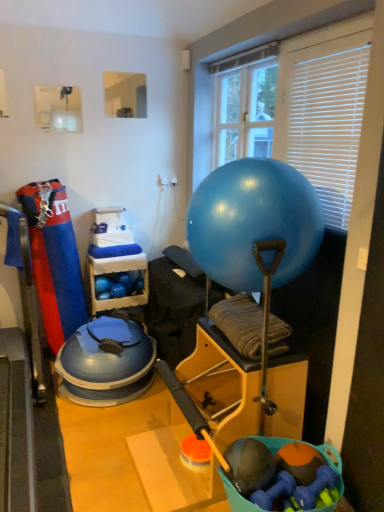
Locate an element on the screen. blue rubber ball at center is located at coordinates tap(254, 224).

This screenshot has height=512, width=384. Describe the element at coordinates (328, 127) in the screenshot. I see `white plastic blinds at upper right` at that location.

What are the coordinates of `blue rubber balls at center` in the screenshot? It's located at (116, 272).

This screenshot has width=384, height=512. In order to click on clear glass mirror at upper center, acting as the second window screen starting from the right in this screenshot , I will do `click(125, 95)`.

Is blue rubber balls at center not close to blue rubber ball at center?

blue rubber balls at center is far away from blue rubber ball at center.

Between blue rubber balls at center and blue rubber ball at center, which one appears on the right side from the viewer's perspective?

From the viewer's perspective, blue rubber ball at center appears more on the right side.

Based on the photo, how many degrees apart are the facing directions of blue rubber balls at center and blue rubber ball at center?

90.7 degrees separate the facing orientations of blue rubber balls at center and blue rubber ball at center.

From the image's perspective, is transparent plastic window screen at upper center, arranged as the second window screen when viewed from the left, under clear glass mirror at upper center, the first window screen in the left-to-right sequence?

Yes, from the image's perspective, transparent plastic window screen at upper center, arranged as the second window screen when viewed from the left, is beneath clear glass mirror at upper center, the first window screen in the left-to-right sequence.

Which is more to the right, transparent plastic window screen at upper center, acting as the first window screen starting from the right, or clear glass mirror at upper center, acting as the second window screen starting from the right?

transparent plastic window screen at upper center, acting as the first window screen starting from the right, is more to the right.

Considering the positions of points (230, 116) and (104, 80), is point (230, 116) farther from camera compared to point (104, 80)?

No.

In the scene shown: Considering the sizes of objects transparent plastic window screen at upper center, acting as the first window screen starting from the right, and clear glass mirror at upper center, the first window screen in the left-to-right sequence, in the image provided, who is wider, transparent plastic window screen at upper center, acting as the first window screen starting from the right, or clear glass mirror at upper center, the first window screen in the left-to-right sequence,?

transparent plastic window screen at upper center, acting as the first window screen starting from the right, is wider.

From the picture: From the image's perspective, does white plastic blinds at upper right appear higher than blue rubber ball at center?

Correct, white plastic blinds at upper right appears higher than blue rubber ball at center in the image.

Can you confirm if white plastic blinds at upper right is taller than blue rubber ball at center?

Correct, white plastic blinds at upper right is much taller as blue rubber ball at center.

Consider the image. Between white plastic blinds at upper right and blue rubber ball at center, which one appears on the left side from the viewer's perspective?

blue rubber ball at center is more to the left.

From a real-world perspective, relative to clear glass mirror at upper center, acting as the second window screen starting from the right, is white plastic blinds at upper right vertically above or below?

From a real-world perspective, white plastic blinds at upper right is physically below clear glass mirror at upper center, acting as the second window screen starting from the right.

Identify the location of blind below the clear glass mirror at upper center, the first window screen in the left-to-right sequence (from a real-world perspective). This screenshot has width=384, height=512. (328, 127).

Which is more to the left, white plastic blinds at upper right or clear glass mirror at upper center, acting as the second window screen starting from the right?

clear glass mirror at upper center, acting as the second window screen starting from the right.

Is white plastic blinds at upper right next to clear glass mirror at upper center, the first window screen in the left-to-right sequence, and touching it?

white plastic blinds at upper right and clear glass mirror at upper center, the first window screen in the left-to-right sequence, are not in contact.

From the image's perspective, relative to white plastic blinds at upper right, is transparent plastic window screen at upper center, acting as the first window screen starting from the right, above or below?

Based on their image positions, transparent plastic window screen at upper center, acting as the first window screen starting from the right, is located above white plastic blinds at upper right.

Between transparent plastic window screen at upper center, acting as the first window screen starting from the right, and white plastic blinds at upper right, which one has larger size?

With larger size is transparent plastic window screen at upper center, acting as the first window screen starting from the right.

Is point (260, 52) farther from viewer compared to point (344, 223)?

Yes, point (260, 52) is behind point (344, 223).

Considering the relative sizes of transparent plastic window screen at upper center, arranged as the second window screen when viewed from the left, and white plastic blinds at upper right in the image provided, is transparent plastic window screen at upper center, arranged as the second window screen when viewed from the left, wider than white plastic blinds at upper right?

Correct, the width of transparent plastic window screen at upper center, arranged as the second window screen when viewed from the left, exceeds that of white plastic blinds at upper right.

Considering the sizes of clear glass mirror at upper center, acting as the second window screen starting from the right, and blue rubber ball at center in the image, is clear glass mirror at upper center, acting as the second window screen starting from the right, taller or shorter than blue rubber ball at center?

Clearly, clear glass mirror at upper center, acting as the second window screen starting from the right, is shorter compared to blue rubber ball at center.

From the picture: Considering the positions of objects clear glass mirror at upper center, acting as the second window screen starting from the right, and blue rubber ball at center in the image provided, who is more to the right, clear glass mirror at upper center, acting as the second window screen starting from the right, or blue rubber ball at center?

blue rubber ball at center is more to the right.

From a real-world perspective, who is located higher, clear glass mirror at upper center, acting as the second window screen starting from the right, or blue rubber ball at center?

clear glass mirror at upper center, acting as the second window screen starting from the right, is physically above.

Which is correct: clear glass mirror at upper center, the first window screen in the left-to-right sequence, is inside blue rubber ball at center, or outside of it?

clear glass mirror at upper center, the first window screen in the left-to-right sequence, is not enclosed by blue rubber ball at center.

Could you tell me if white plastic blinds at upper right is turned towards blue rubber balls at center?

No.

Considering the relative sizes of white plastic blinds at upper right and blue rubber balls at center in the image provided, is white plastic blinds at upper right thinner than blue rubber balls at center?

Indeed, white plastic blinds at upper right has a lesser width compared to blue rubber balls at center.

Which is correct: white plastic blinds at upper right is inside blue rubber balls at center, or outside of it?

white plastic blinds at upper right is not enclosed by blue rubber balls at center.

Considering the relative positions of white plastic blinds at upper right and blue rubber balls at center in the image provided, is white plastic blinds at upper right to the left of blue rubber balls at center from the viewer's perspective?

No, white plastic blinds at upper right is not to the left of blue rubber balls at center.

Locate an element on the screen. ball on the right of blue rubber balls at center is located at coordinates (254, 224).

Where is `window screen below the clear glass mirror at upper center, acting as the second window screen starting from the right (from the image's perspective)`? This screenshot has height=512, width=384. window screen below the clear glass mirror at upper center, acting as the second window screen starting from the right (from the image's perspective) is located at coordinates (244, 104).

When comparing their distances from clear glass mirror at upper center, acting as the second window screen starting from the right, does transparent plastic window screen at upper center, arranged as the second window screen when viewed from the left, or blue rubber balls at center seem further?

blue rubber balls at center is positioned further to the anchor clear glass mirror at upper center, acting as the second window screen starting from the right.

Estimate the real-world distances between objects in this image. Which object is closer to clear glass mirror at upper center, acting as the second window screen starting from the right, transparent plastic window screen at upper center, acting as the first window screen starting from the right, or blue rubber ball at center?

transparent plastic window screen at upper center, acting as the first window screen starting from the right, is positioned closer to the anchor clear glass mirror at upper center, acting as the second window screen starting from the right.

Based on their spatial positions, is clear glass mirror at upper center, the first window screen in the left-to-right sequence, or blue rubber balls at center further from white plastic blinds at upper right?

blue rubber balls at center lies further to white plastic blinds at upper right than the other object.

Which object lies nearer to the anchor point white plastic blinds at upper right, blue rubber ball at center or blue rubber balls at center?

blue rubber ball at center lies closer to white plastic blinds at upper right than the other object.

From the image, which object appears to be farther from blue rubber balls at center, blue rubber ball at center or white plastic blinds at upper right?

white plastic blinds at upper right.

Estimate the real-world distances between objects in this image. Which object is closer to white plastic blinds at upper right, transparent plastic window screen at upper center, acting as the first window screen starting from the right, or blue rubber ball at center?

blue rubber ball at center is positioned closer to the anchor white plastic blinds at upper right.

Based on their spatial positions, is blue rubber ball at center or clear glass mirror at upper center, acting as the second window screen starting from the right, further from white plastic blinds at upper right?

clear glass mirror at upper center, acting as the second window screen starting from the right, is positioned further to the anchor white plastic blinds at upper right.

Which object lies further to the anchor point blue rubber ball at center, blue rubber balls at center or white plastic blinds at upper right?

blue rubber balls at center lies further to blue rubber ball at center than the other object.

Locate an element on the screen. blind between blue rubber ball at center and clear glass mirror at upper center, acting as the second window screen starting from the right, from front to back is located at coordinates (328, 127).

Locate an element on the screen. window screen between blue rubber ball at center and blue rubber balls at center from front to back is located at coordinates (244, 104).

I want to click on shelf located between white plastic blinds at upper right and clear glass mirror at upper center, acting as the second window screen starting from the right, in the depth direction, so click(116, 272).

The image size is (384, 512). What are the coordinates of `blind between blue rubber ball at center and blue rubber balls at center from front to back` in the screenshot? It's located at (328, 127).